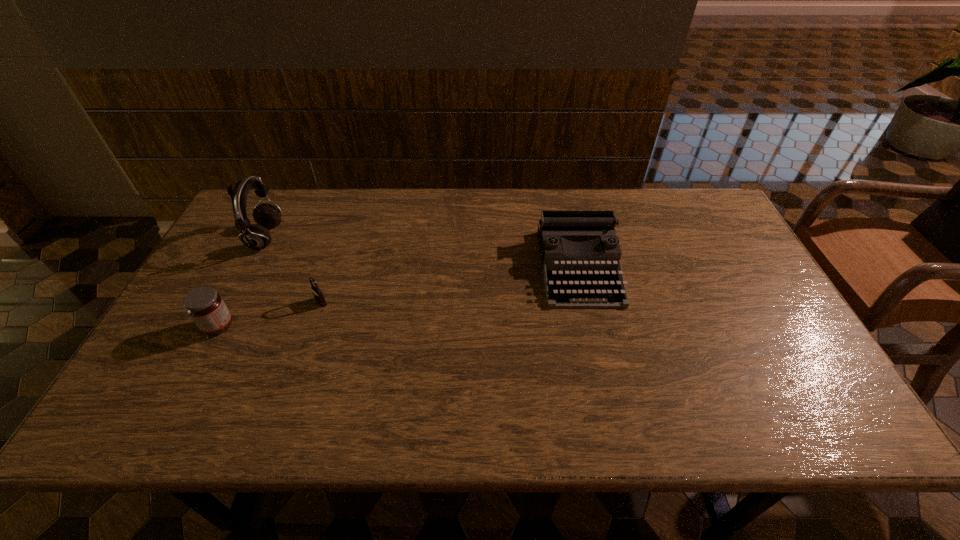
Image resolution: width=960 pixels, height=540 pixels. I want to click on typewriter positioned at the far edge, so click(571, 281).

You are a GUI agent. You are given a task and a screenshot of the screen. Output one action in this format:
    pyautogui.click(x=<x>, y=<y>)
    Task: Click on the earphone that is at the left edge
    The image size is (960, 540).
    Given the screenshot: What is the action you would take?
    pyautogui.click(x=257, y=237)

I want to click on jam at the left edge, so click(x=205, y=306).

The image size is (960, 540). Find the location of `object positioned at the far left corner`. object positioned at the far left corner is located at coordinates (257, 237).

The height and width of the screenshot is (540, 960). In order to click on vacant space at the far edge of the desktop in this screenshot , I will do `click(510, 230)`.

In the image, there is a desktop. Where is `free space at the near edge`? This screenshot has height=540, width=960. free space at the near edge is located at coordinates (724, 421).

I want to click on vacant space at the right edge, so click(759, 322).

This screenshot has width=960, height=540. Find the location of `free location at the far right corner`. free location at the far right corner is located at coordinates coord(692,221).

The image size is (960, 540). Find the location of `free point between the earphone and the rightmost object`. free point between the earphone and the rightmost object is located at coordinates (422, 252).

Where is `vacant area that lies between the jam and the rightmost object`? This screenshot has width=960, height=540. vacant area that lies between the jam and the rightmost object is located at coordinates (398, 296).